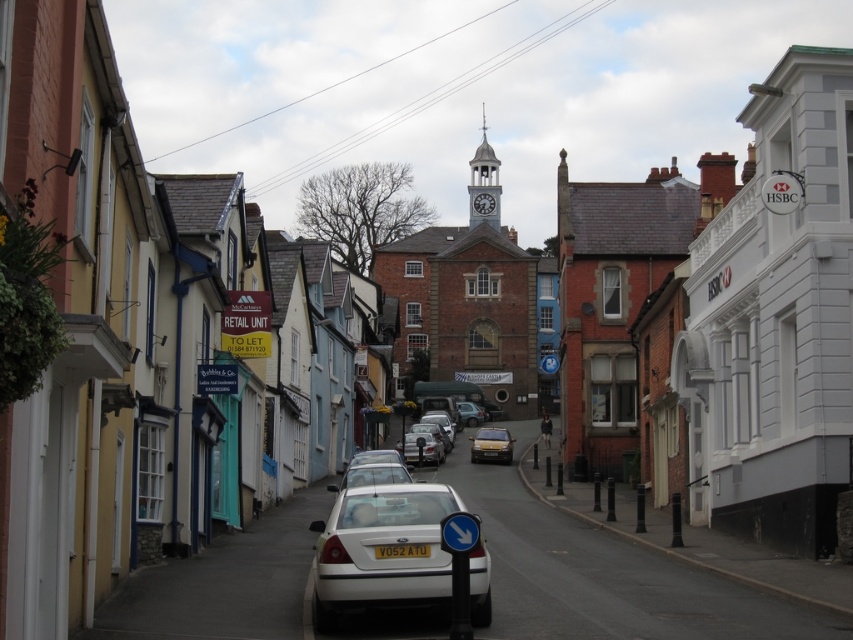
Is polished brass clock tower at center below yellow matte license plate at center?

No.

Between polished brass clock tower at center and yellow matte license plate at center, which one has less height?

With less height is yellow matte license plate at center.

Is point (486, 148) closer to camera compared to point (387, 544)?

No, it is not.

The image size is (853, 640). I want to click on polished brass clock tower at center, so click(485, 184).

Based on the photo, does gold metallic car at center have a greater width compared to yellow matte license plate at center?

Correct, the width of gold metallic car at center exceeds that of yellow matte license plate at center.

Does point (506, 445) come farther from viewer compared to point (397, 547)?

Yes.

Does point (496, 452) come closer to viewer compared to point (383, 552)?

No, (496, 452) is behind (383, 552).

Locate an element on the screen. gold metallic car at center is located at coordinates (491, 444).

From the picture: Between white matte sedan at center and polished brass clock tower at center, which one has more height?

Standing taller between the two is polished brass clock tower at center.

Is point (369, 492) farther from camera compared to point (486, 196)?

No, (369, 492) is closer to viewer.

Is point (357, 579) farther from camera compared to point (488, 198)?

No, it is in front of (488, 198).

Identify the location of white matte sedan at center. (x=380, y=544).